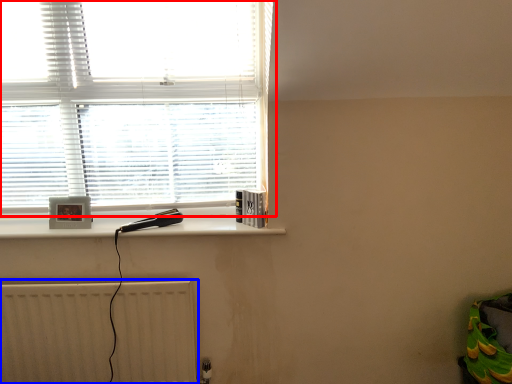
Question: Among these objects, which one is nearest to the camera, window (highlighted by a red box) or radiator (highlighted by a blue box)?

Choices:
 (A) window
 (B) radiator

Answer: (A)